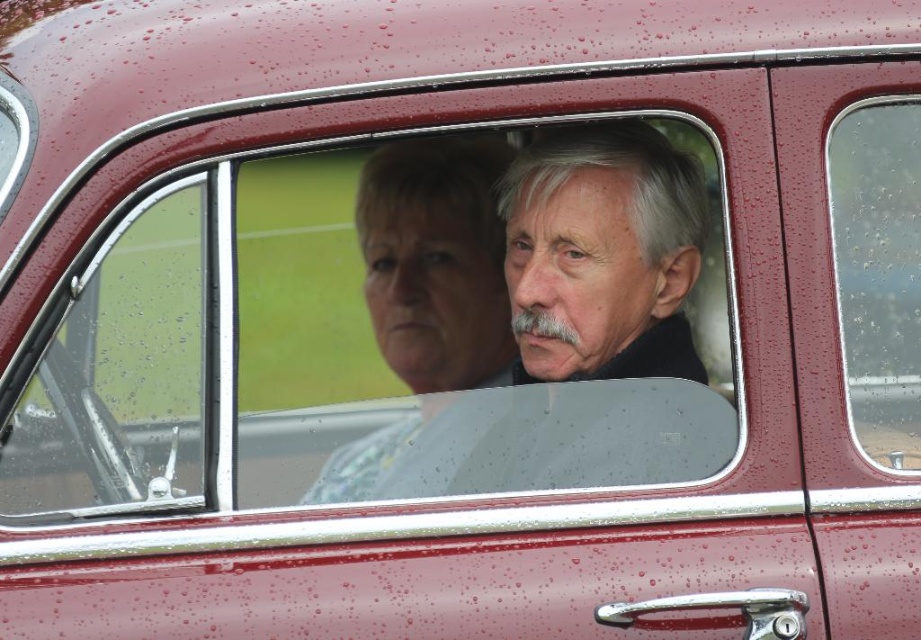
You are a photographer standing at the front passenger window of a vintage car. You want to take a photo of the smooth gray hair at center. Where should you aim your camera to capture it?

You should aim your camera at point 0.522 on the x axis and 0.603 on the y axis to capture the smooth gray hair at center.

You are a photographer trying to capture a clear shot of the smooth gray hair at center and the transparent glass window at right. Which object is positioned lower in the image?

The smooth gray hair at center is located below the transparent glass window at right, so it is positioned lower in the image.

You are a photographer trying to capture a clear shot of the smooth gray jacket at center and the transparent glass window at right. However, there are water droplets on the window. Which object might be more affected by the water droplets?

The transparent glass window at right is more affected by the water droplets because it is the surface where the droplets are present, while the smooth gray jacket at center is not on the window.